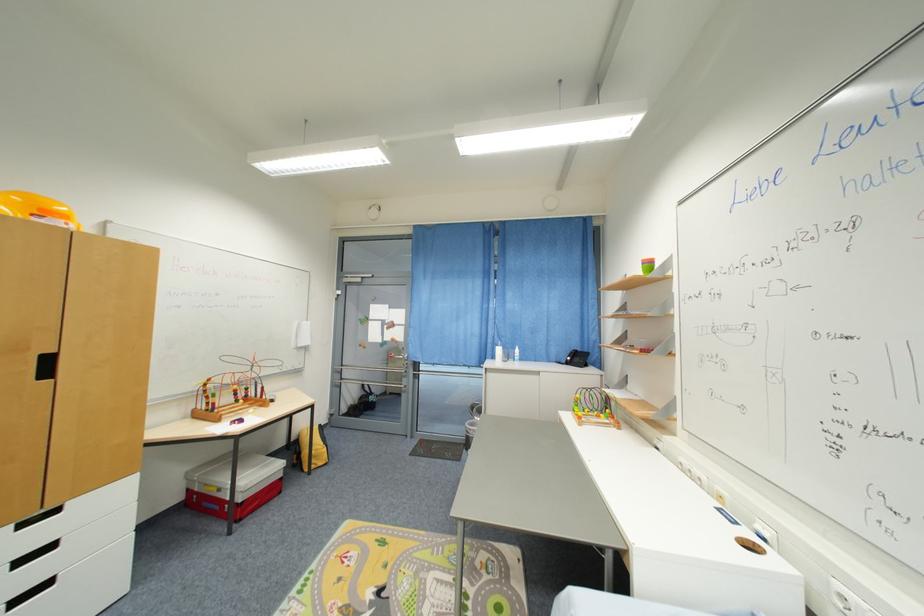
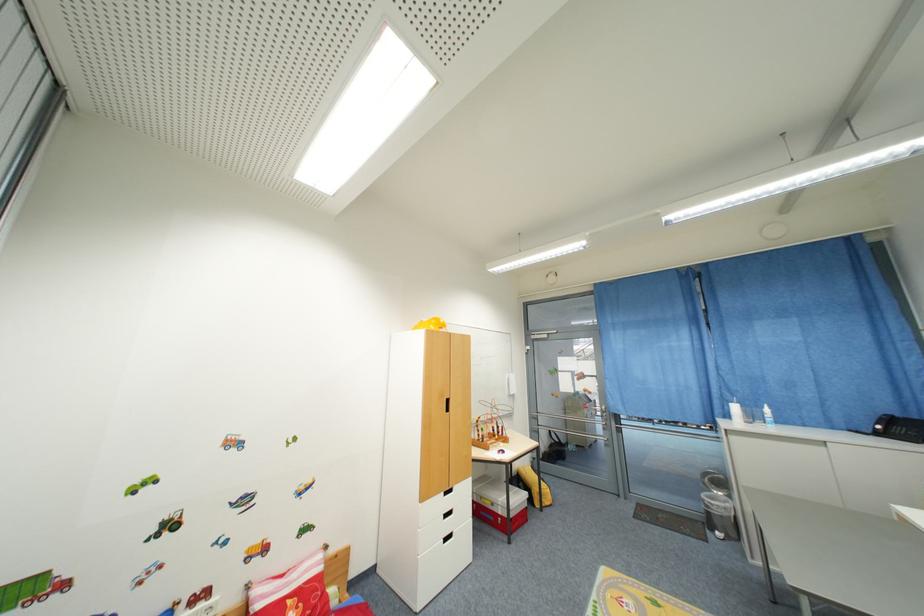
Find the pixel in the second image that matches [223,509] in the first image.

(497, 521)